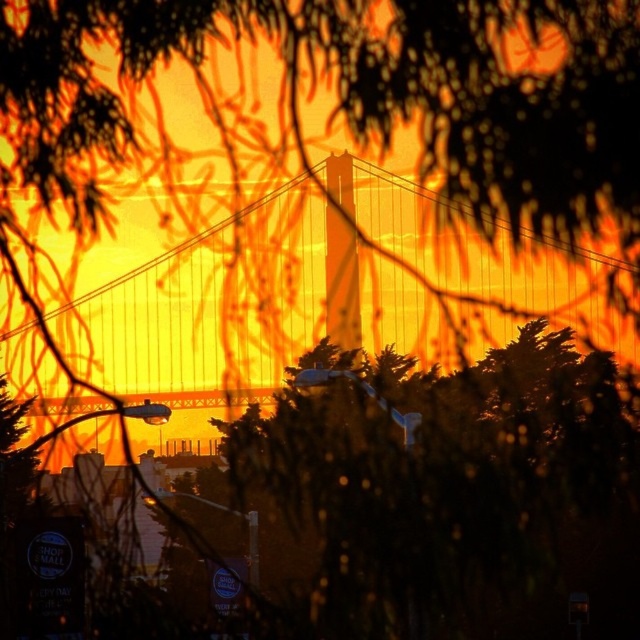
Looking at this image, between dark green leafy tree at center and metallic suspension bridge at center, which one is positioned higher?

metallic suspension bridge at center is higher up.

Can you confirm if dark green leafy tree at center is smaller than metallic suspension bridge at center?

No, dark green leafy tree at center is not smaller than metallic suspension bridge at center.

Who is more distant from viewer, [429,420] or [532,292]?

The point [532,292] is behind.

I want to click on dark green leafy tree at center, so click(x=445, y=497).